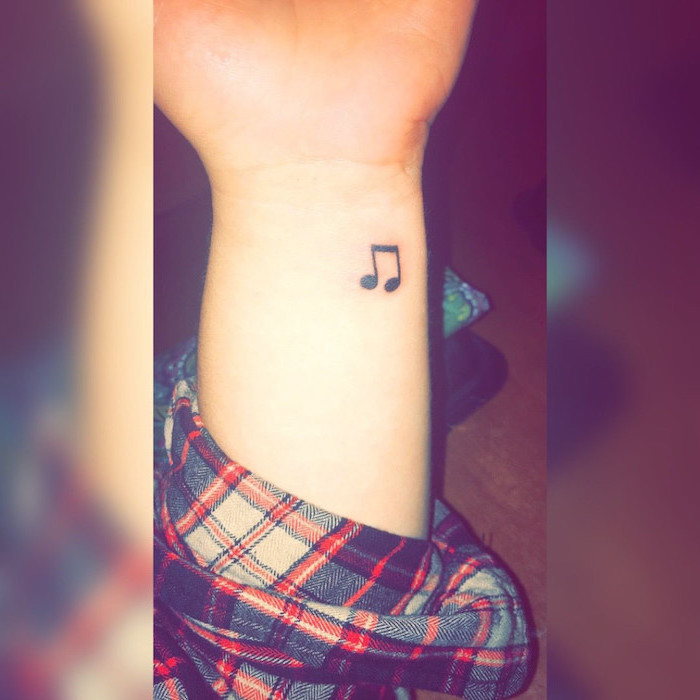
Locate an element on the screen. The height and width of the screenshot is (700, 700). side of table is located at coordinates (167, 368).